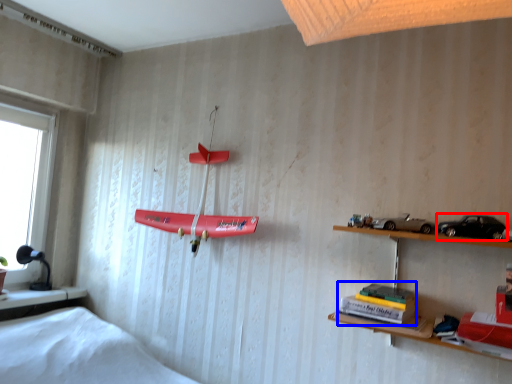
Question: Which point is closer to the camera, toy car (highlighted by a red box) or book (highlighted by a blue box)?

Choices:
 (A) toy car
 (B) book

Answer: (B)